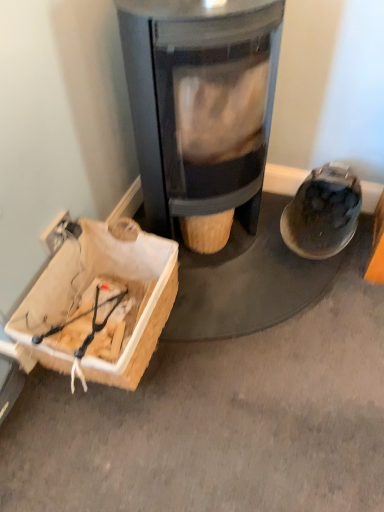
Where is `free spot to the right of wooden crate at lower left`? free spot to the right of wooden crate at lower left is located at coordinates (232, 333).